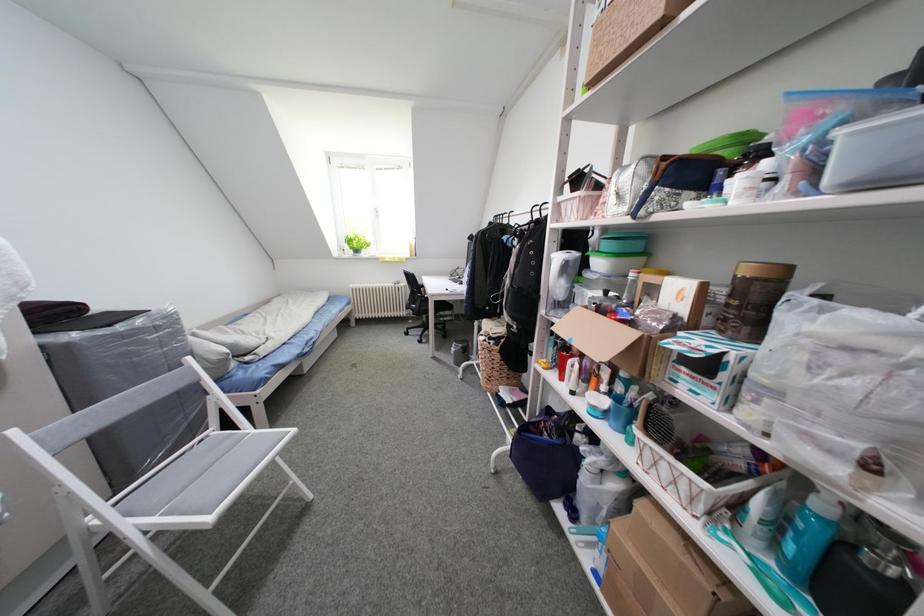
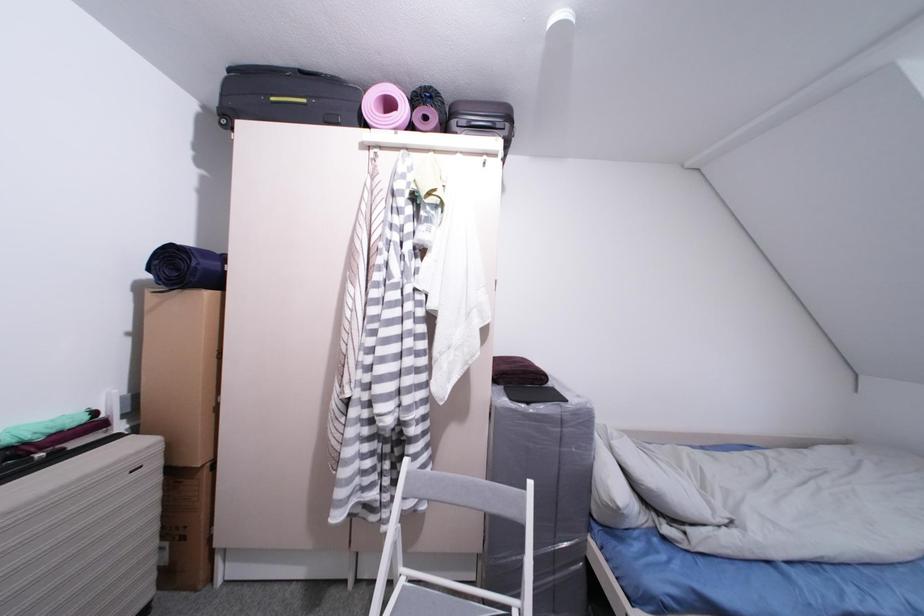
Question: The images are taken continuously from a first-person perspective. In which direction is your viewpoint rotating?

Choices:
 (A) Left
 (B) Right
 (C) Up
 (D) Down

Answer: (A)